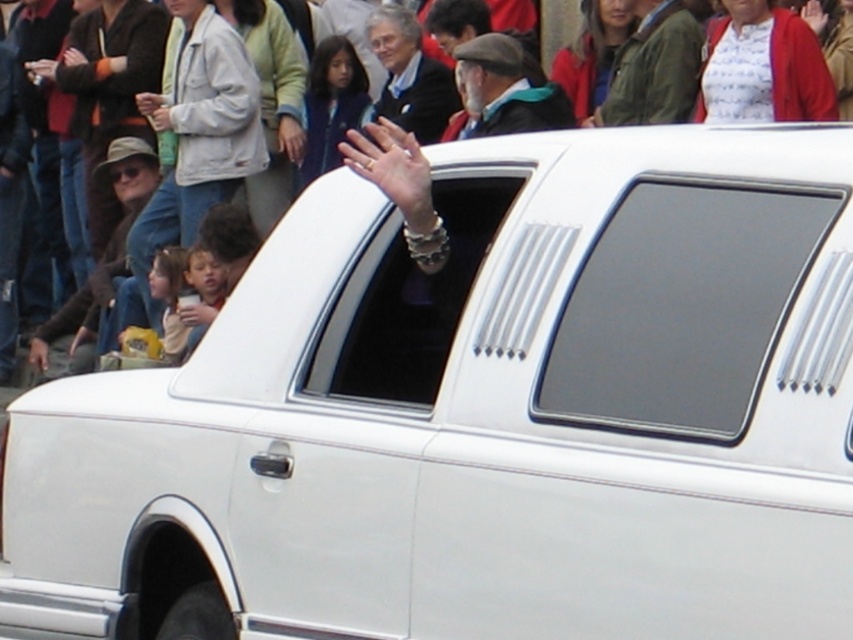
Question: Does matte white car at center appear on the left side of matte black suit at center?

Choices:
 (A) yes
 (B) no

Answer: (A)

Question: Does matte black window at center have a smaller size compared to matte black suit at center?

Choices:
 (A) no
 (B) yes

Answer: (B)

Question: Is matte black window at center in front of matte black suit at center?

Choices:
 (A) no
 (B) yes

Answer: (B)

Question: Among these objects, which one is nearest to the camera?

Choices:
 (A) matte black suit at center
 (B) matte white car at center
 (C) green textured jacket at upper center

Answer: (C)

Question: Which of the following is the closest to the observer?

Choices:
 (A) (680, 10)
 (B) (473, 211)

Answer: (B)

Question: Which point is farther from the camera taking this photo?

Choices:
 (A) (461, 54)
 (B) (584, 276)

Answer: (A)